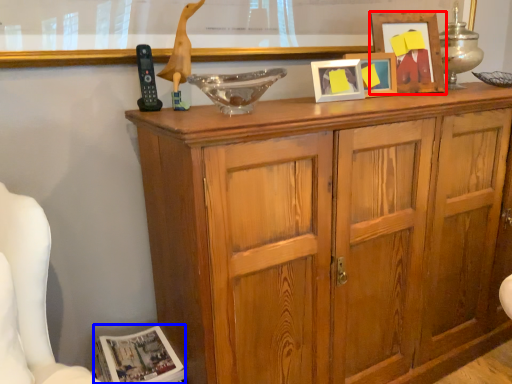
Question: Among these objects, which one is nearest to the camera, picture frame (highlighted by a red box) or magazine (highlighted by a blue box)?

Choices:
 (A) picture frame
 (B) magazine

Answer: (B)